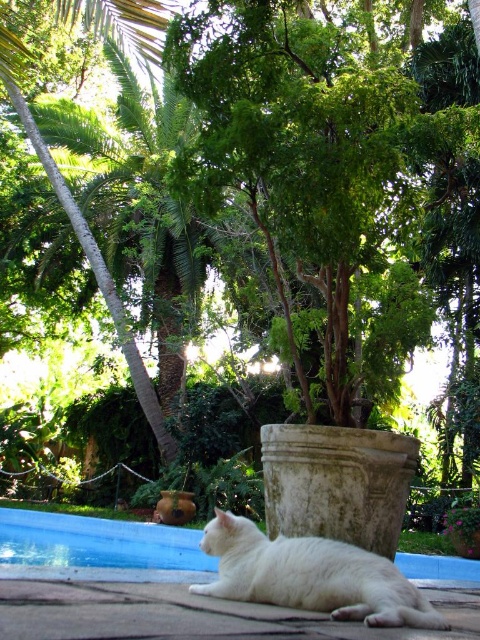
You are a photographer standing at the edge of the blue smooth swimming pool at lower center, and you want to take a closeup photo of the white fur cat at lower left. Considering your camera has a maximum zoom range of 4 meters, will you be able to capture the cat without moving closer?

The white fur cat at lower left and blue smooth swimming pool at lower center are 4.95 meters apart. Since the camera can only zoom up to 4 meters, you cannot capture the cat without moving closer.

You are a photographer aiming to capture the white fur cat at lower left and the blue smooth swimming pool at lower center in a single shot. Based on their positions, which object is closer to the left edge of the photo?

The blue smooth swimming pool at lower center is closer to the left edge of the photo because the white fur cat at lower left is positioned on the right side of it.

You are standing in the tropical garden and want to place a small statue between the two points, point (x=349, y=552) and point (x=50, y=513). Which point should the statue be closer to if you want it to be more visible to visitors approaching from the front?

The statue should be placed closer to point (x=349, y=552) because it is closer to the viewer, making it more visible to visitors approaching from the front.